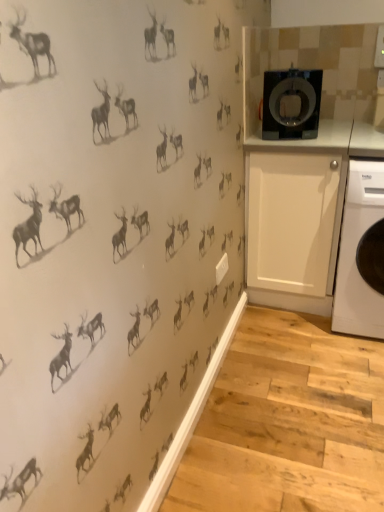
Question: Does black glossy washing machine at upper right contain white matte cabinet at right?

Choices:
 (A) yes
 (B) no

Answer: (B)

Question: Is black glossy washing machine at upper right to the left of white matte cabinet at right from the viewer's perspective?

Choices:
 (A) yes
 (B) no

Answer: (A)

Question: Is black glossy washing machine at upper right at the right side of white matte cabinet at right?

Choices:
 (A) yes
 (B) no

Answer: (B)

Question: Is black glossy washing machine at upper right closer to the viewer compared to white matte cabinet at right?

Choices:
 (A) no
 (B) yes

Answer: (B)

Question: Does black glossy washing machine at upper right have a lesser height compared to white matte cabinet at right?

Choices:
 (A) yes
 (B) no

Answer: (A)

Question: Based on their sizes in the image, would you say white matte cabinet at right is bigger or smaller than black glossy washing machine at upper right?

Choices:
 (A) small
 (B) big

Answer: (B)

Question: From a real-world perspective, is white matte cabinet at right physically located above or below black glossy washing machine at upper right?

Choices:
 (A) below
 (B) above

Answer: (A)

Question: From the image's perspective, is white matte cabinet at right positioned above or below black glossy washing machine at upper right?

Choices:
 (A) below
 (B) above

Answer: (A)

Question: Is white matte cabinet at right inside the boundaries of black glossy washing machine at upper right, or outside?

Choices:
 (A) outside
 (B) inside

Answer: (A)

Question: Is point (345, 243) positioned closer to the camera than point (281, 89)?

Choices:
 (A) farther
 (B) closer

Answer: (B)

Question: Is white plastic washing machine at right inside the boundaries of black glossy washing machine at upper right, or outside?

Choices:
 (A) outside
 (B) inside

Answer: (A)

Question: In the image, is white plastic washing machine at right positioned in front of or behind black glossy washing machine at upper right?

Choices:
 (A) behind
 (B) front

Answer: (B)

Question: Is white plastic washing machine at right wider or thinner than black glossy washing machine at upper right?

Choices:
 (A) wide
 (B) thin

Answer: (A)

Question: Based on their positions, is black glossy washing machine at upper right located to the left or right of white plastic washing machine at right?

Choices:
 (A) right
 (B) left

Answer: (B)

Question: Is black glossy washing machine at upper right spatially inside white plastic washing machine at right, or outside of it?

Choices:
 (A) outside
 (B) inside

Answer: (A)